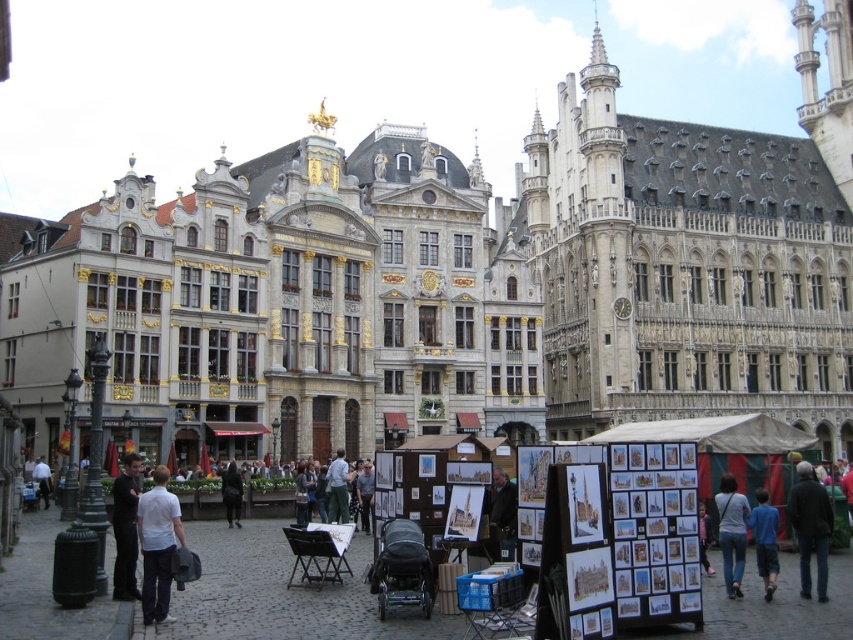
Who is positioned more to the right, blue cotton shirt at lower right or green pants at center?

blue cotton shirt at lower right

Does blue cotton shirt at lower right have a lesser width compared to green pants at center?

No.

Does point (769, 557) come in front of point (346, 502)?

Yes, point (769, 557) is closer to viewer.

Locate an element on the screen. blue cotton shirt at lower right is located at coordinates (764, 540).

Between dark brown leather jacket at lower right and white shirt at lower left, which one appears on the left side from the viewer's perspective?

white shirt at lower left is more to the left.

Which of these two, dark brown leather jacket at lower right or white shirt at lower left, stands shorter?

white shirt at lower left

Does point (827, 515) come farther from viewer compared to point (48, 467)?

No, it is not.

I want to click on dark brown leather jacket at lower right, so click(810, 528).

Does dark brown leather jacket at lower right have a greater height compared to green pants at center?

Yes, dark brown leather jacket at lower right is taller than green pants at center.

Does dark brown leather jacket at lower right have a lesser height compared to green pants at center?

No.

Who is more forward, (827, 516) or (337, 465)?

Positioned in front is point (827, 516).

Identify the location of dark brown leather jacket at lower right. (810, 528).